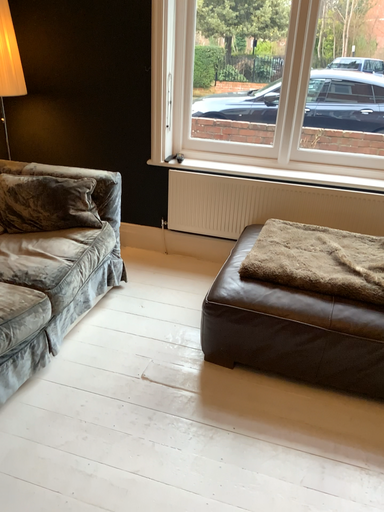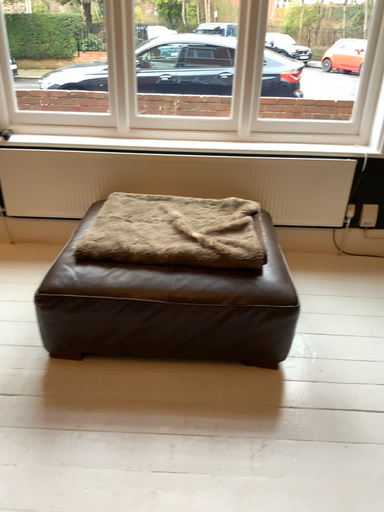
Question: How did the camera likely rotate when shooting the video?

Choices:
 (A) rotated right
 (B) rotated left

Answer: (A)